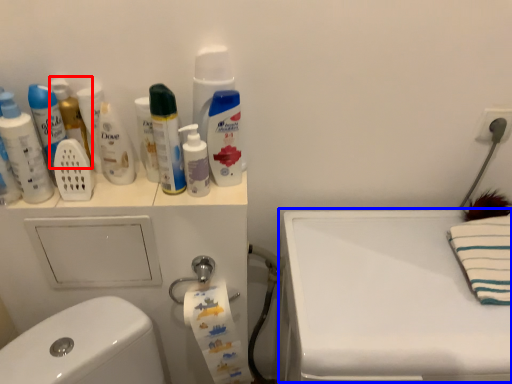
Question: Which object appears farthest to the camera in this image, mouthwash (highlighted by a red box) or counter top (highlighted by a blue box)?

Choices:
 (A) mouthwash
 (B) counter top

Answer: (A)